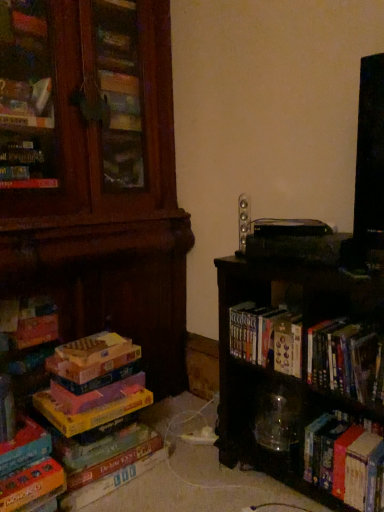
Where is `empty space that is ontop of hardcover books at center, arranged as the third book when viewed from the right (from a real-world perspective)`? The width and height of the screenshot is (384, 512). empty space that is ontop of hardcover books at center, arranged as the third book when viewed from the right (from a real-world perspective) is located at coordinates (272, 312).